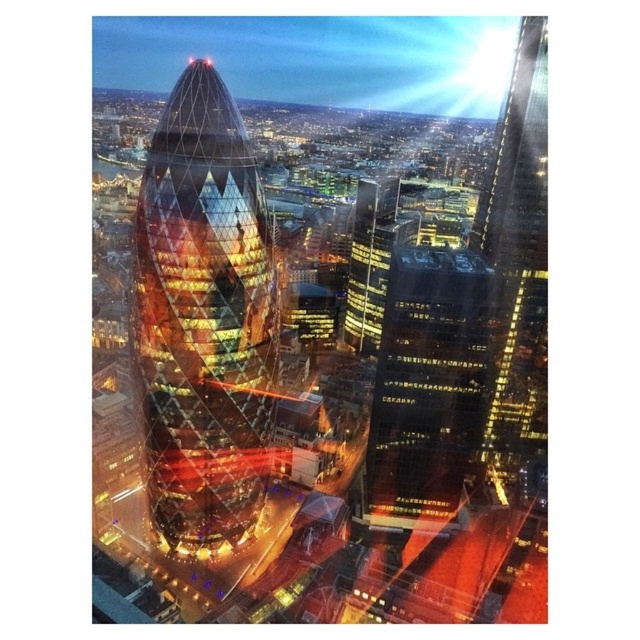
Question: Is glassy reflective skyscraper at center above glassy skyscraper at right?

Choices:
 (A) no
 (B) yes

Answer: (A)

Question: Which of the following is the closest to the observer?

Choices:
 (A) glassy skyscraper at upper right
 (B) glassy reflective building at center
 (C) glassy reflective skyscraper at center

Answer: (B)

Question: Which point is farther to the camera?

Choices:
 (A) (397, 228)
 (B) (534, 92)
 (C) (412, 310)
 (D) (212, 257)

Answer: (A)

Question: Which of these objects is positioned farthest from the glassy reflective skyscraper at center?

Choices:
 (A) shiny glass tower at center
 (B) glassy skyscraper at right
 (C) glassy reflective building at center
 (D) glassy skyscraper at upper right

Answer: (C)

Question: Does glassy reflective building at center have a larger size compared to glassy skyscraper at right?

Choices:
 (A) yes
 (B) no

Answer: (A)

Question: Is shiny glass tower at center smaller than glassy reflective skyscraper at center?

Choices:
 (A) yes
 (B) no

Answer: (B)